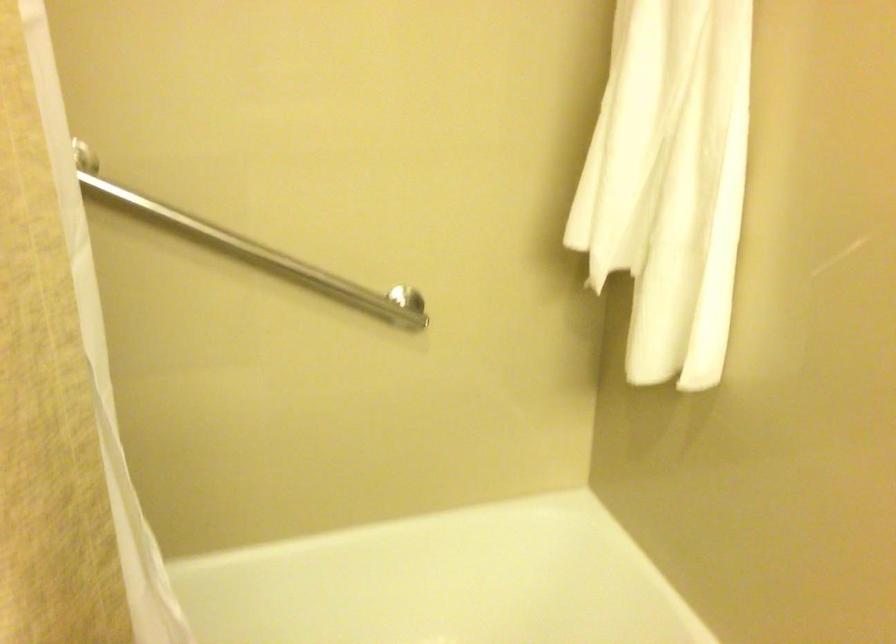
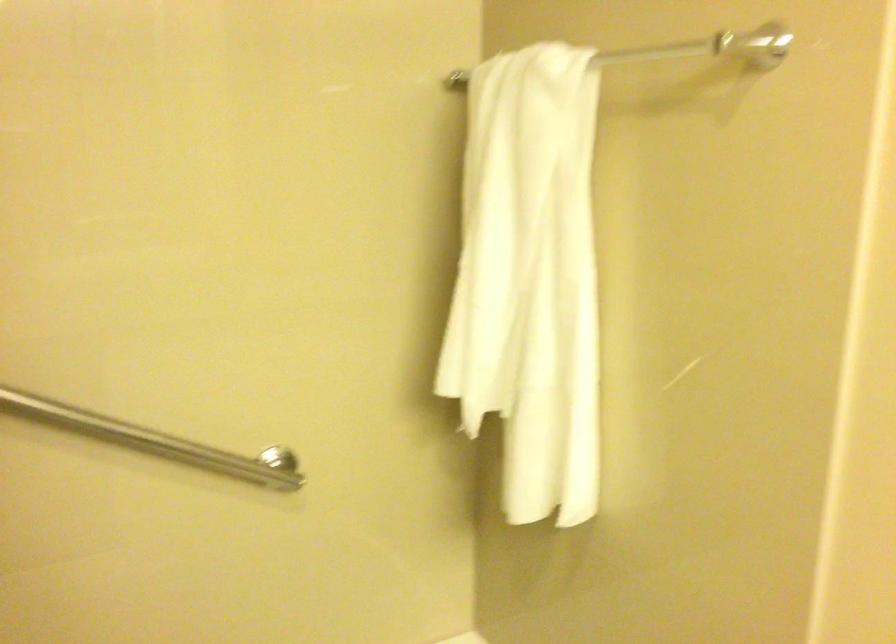
Question: What movement of the cameraman would produce the second image?

Choices:
 (A) Left
 (B) Right
 (C) Forward
 (D) Backward

Answer: (A)